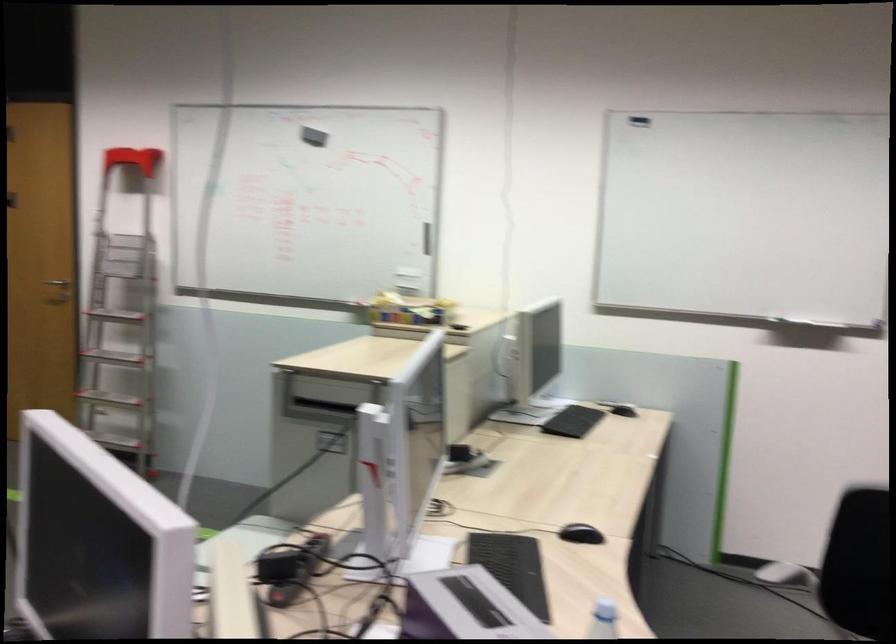
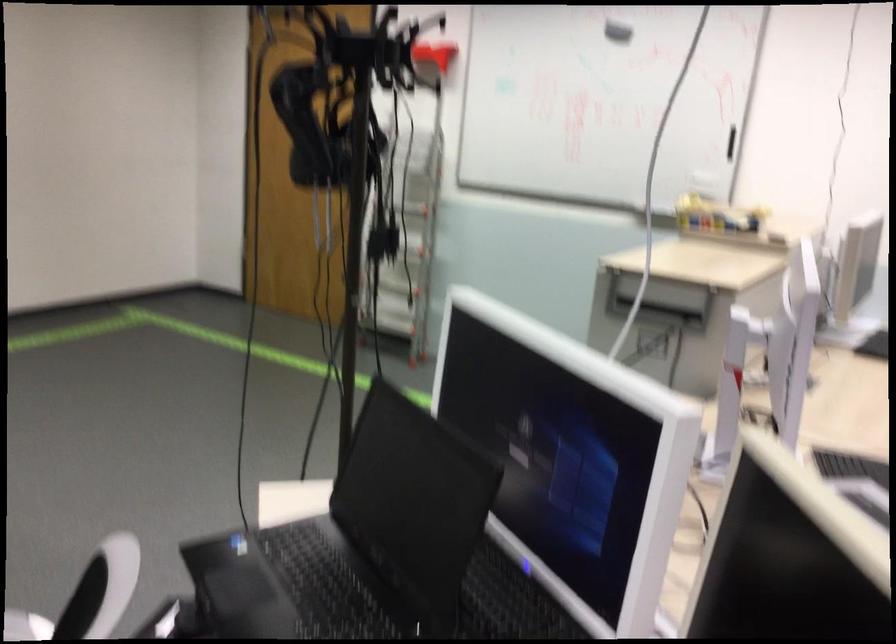
Question: The camera is either moving clockwise (left) or counter-clockwise (right) around the object. The first image is from the beginning of the video and the second image is from the end. Is the camera moving left or right when shooting the video?

Choices:
 (A) Left
 (B) Right

Answer: (B)